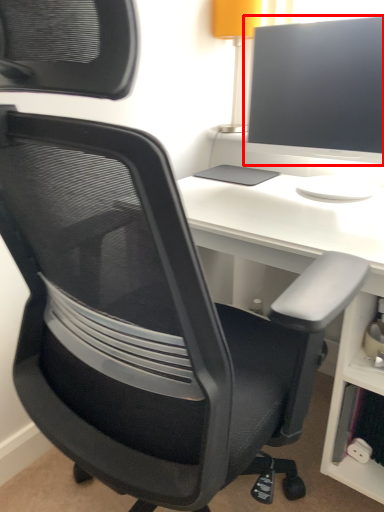
Question: From the image's perspective, considering the relative positions of computer monitor (annotated by the red box) and desk in the image provided, where is computer monitor (annotated by the red box) located with respect to the staircase?

Choices:
 (A) above
 (B) below

Answer: (A)